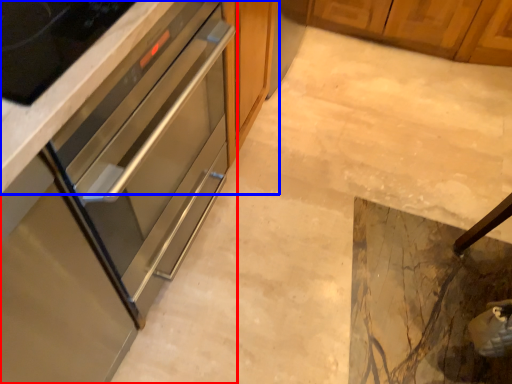
Question: Which of the following is the closest to the observer, cabinetry (highlighted by a red box) or cabinetry (highlighted by a blue box)?

Choices:
 (A) cabinetry
 (B) cabinetry

Answer: (A)